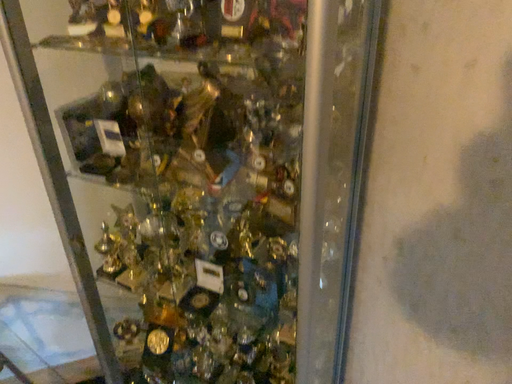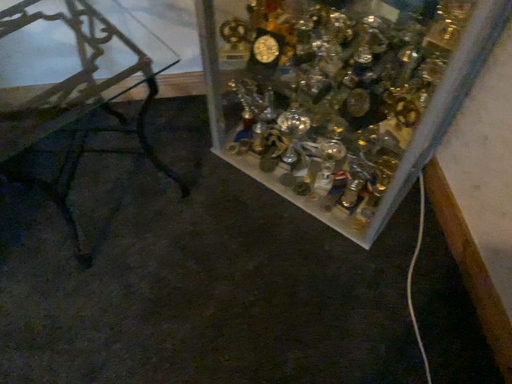
Question: Which way did the camera rotate in the video?

Choices:
 (A) rotated downward
 (B) rotated upward

Answer: (A)